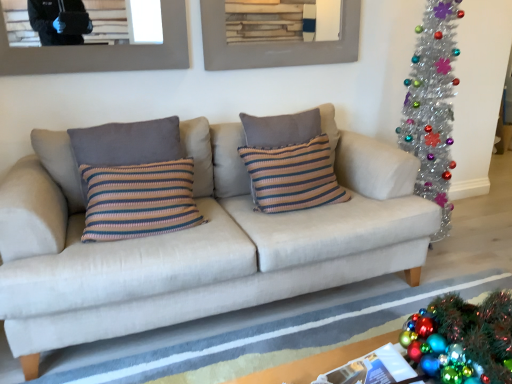
The height and width of the screenshot is (384, 512). I want to click on free area below brushed metal picture frame at upper center, the second picture frame from the right (from a real-world perspective), so click(x=104, y=108).